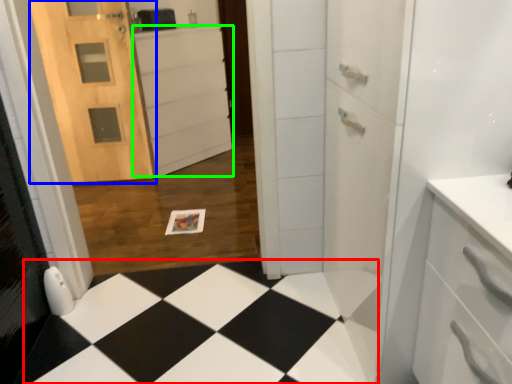
Question: Considering the real-world distances, which object is farthest from square (highlighted by a red box)? door (highlighted by a blue box) or cabinetry (highlighted by a green box)?

Choices:
 (A) door
 (B) cabinetry

Answer: (B)